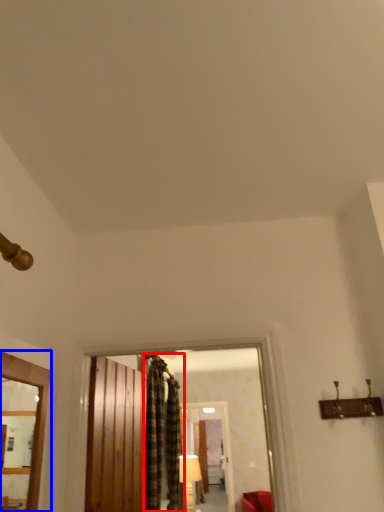
Question: Which of the following is the farthest to the observer, curtain (highlighted by a red box) or window (highlighted by a blue box)?

Choices:
 (A) curtain
 (B) window

Answer: (A)